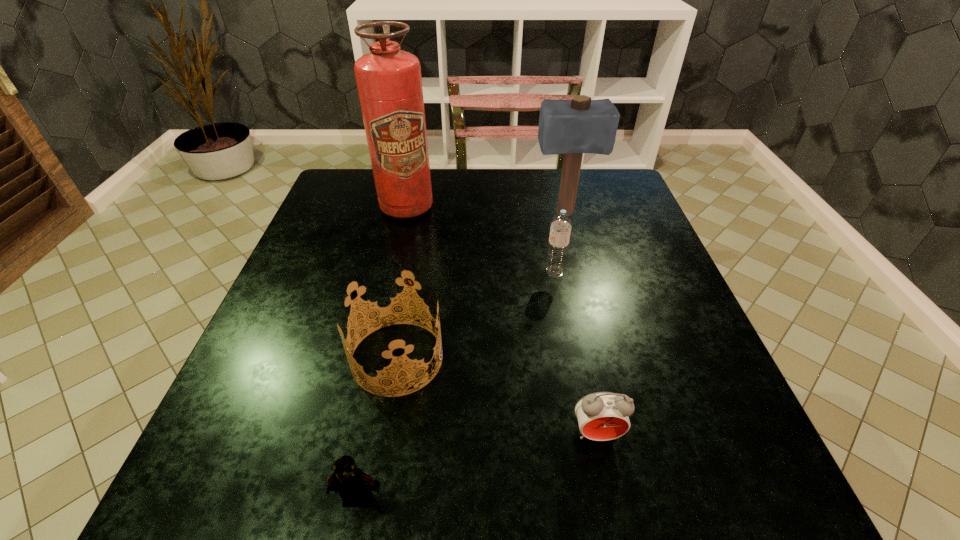
The height and width of the screenshot is (540, 960). Identify the location of free space between the fire extinguisher and the second nearest object. (501, 321).

Locate an element on the screen. free spot between the mallet and the fourth farthest object is located at coordinates (481, 286).

Identify which object is the closest to the third farthest object. Please provide its 2D coordinates. Your answer should be formatted as a tuple, i.e. [(x, y)], where the tuple contains the x and y coordinates of a point satisfying the conditions above.

[(572, 127)]

Select which object is the fourth closest to the fifth shortest object. Please provide its 2D coordinates. Your answer should be formatted as a tuple, i.e. [(x, y)], where the tuple contains the x and y coordinates of a point satisfying the conditions above.

[(602, 416)]

Identify the location of vacant area in the image that satisfies the following two spatial constraints: 1. on the label side of the fifth shortest object; 2. on the left side of the tallest object. (405, 213).

Find the location of a particular element. The image size is (960, 540). blank space that satisfies the following two spatial constraints: 1. on the label side of the tallest object; 2. on the right side of the fourth farthest object is located at coordinates (372, 357).